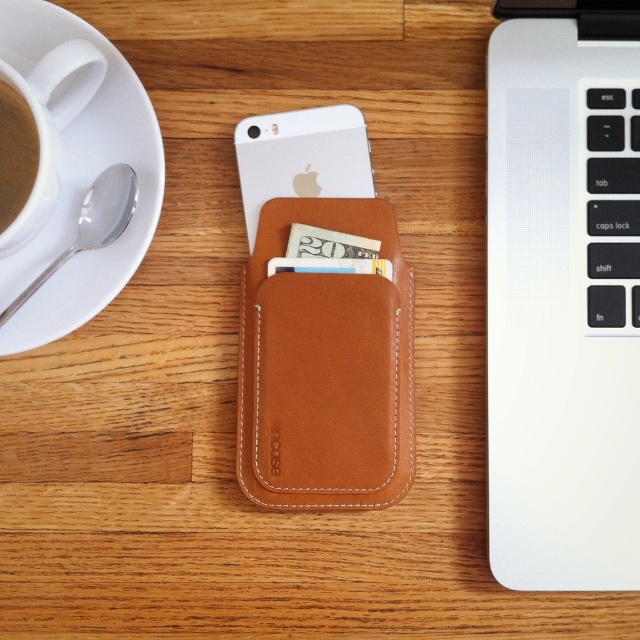
Between white matte iphone at center and brown matte cup of coffee at left, which one has more height?

white matte iphone at center is taller.

Who is positioned more to the left, white matte iphone at center or brown matte cup of coffee at left?

brown matte cup of coffee at left is more to the left.

Is point (296, 118) positioned after point (17, 212)?

Yes.

Locate an element on the screen. The image size is (640, 640). white matte iphone at center is located at coordinates (301, 157).

Locate an element on the screen. white ceramic saucer at upper left is located at coordinates (76, 164).

Who is more forward, (x=150, y=141) or (x=8, y=102)?

Point (x=8, y=102)

Does point (72, 90) lie in front of point (20, 122)?

That is False.

The height and width of the screenshot is (640, 640). I want to click on white ceramic saucer at upper left, so click(76, 164).

Between white matte laptop at upper right and brown matte cup of coffee at left, which one is positioned lower?

Positioned lower is white matte laptop at upper right.

Is point (486, 76) farther from camera compared to point (20, 198)?

That is True.

The width and height of the screenshot is (640, 640). I want to click on white matte laptop at upper right, so click(x=563, y=294).